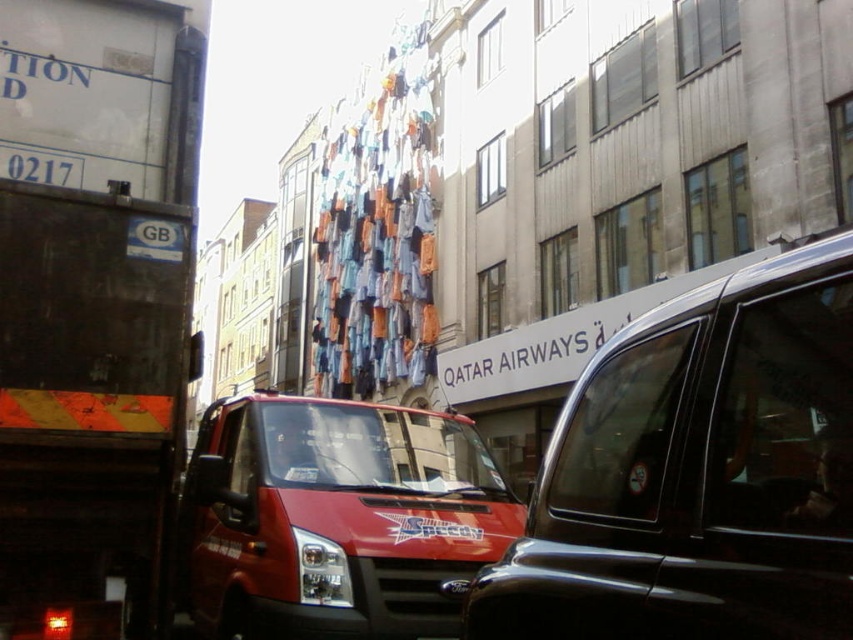
Question: Which of these objects is positioned farthest from the matte red van at center?

Choices:
 (A) black glossy taxi at center-right
 (B) matte black truck at left

Answer: (A)

Question: Which point is farther from the camera taking this photo?

Choices:
 (A) (322, 468)
 (B) (109, 52)
 (C) (805, 596)

Answer: (A)

Question: Which point is farther from the camera taking this photo?

Choices:
 (A) (236, 518)
 (B) (791, 326)

Answer: (A)

Question: Does matte black truck at left appear over black glossy taxi at center-right?

Choices:
 (A) yes
 (B) no

Answer: (A)

Question: Can you confirm if black glossy taxi at center-right is bigger than matte red van at center?

Choices:
 (A) no
 (B) yes

Answer: (A)

Question: Where is matte black truck at left located in relation to black glossy taxi at center-right in the image?

Choices:
 (A) above
 (B) below

Answer: (A)